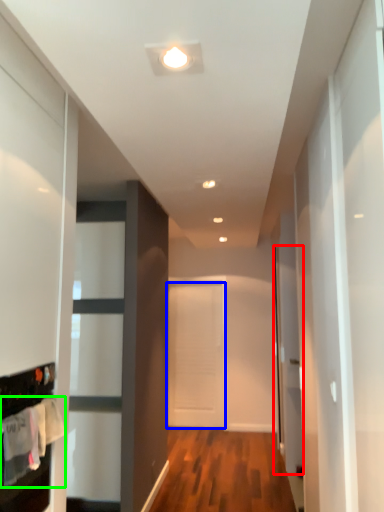
Question: Which object is positioned closest to glass door (highlighted by a red box)? Select from door (highlighted by a blue box) and laundry (highlighted by a green box).

Choices:
 (A) door
 (B) laundry

Answer: (A)